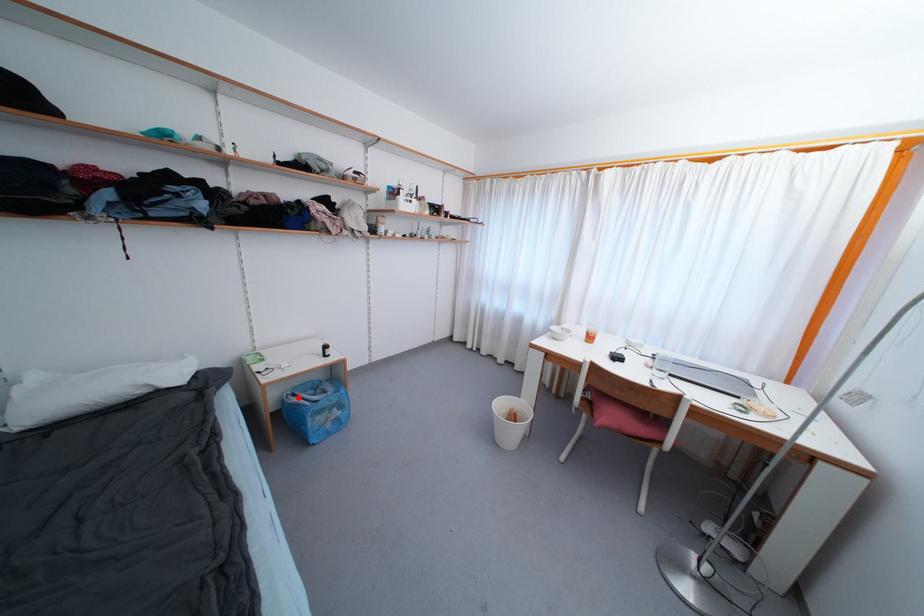
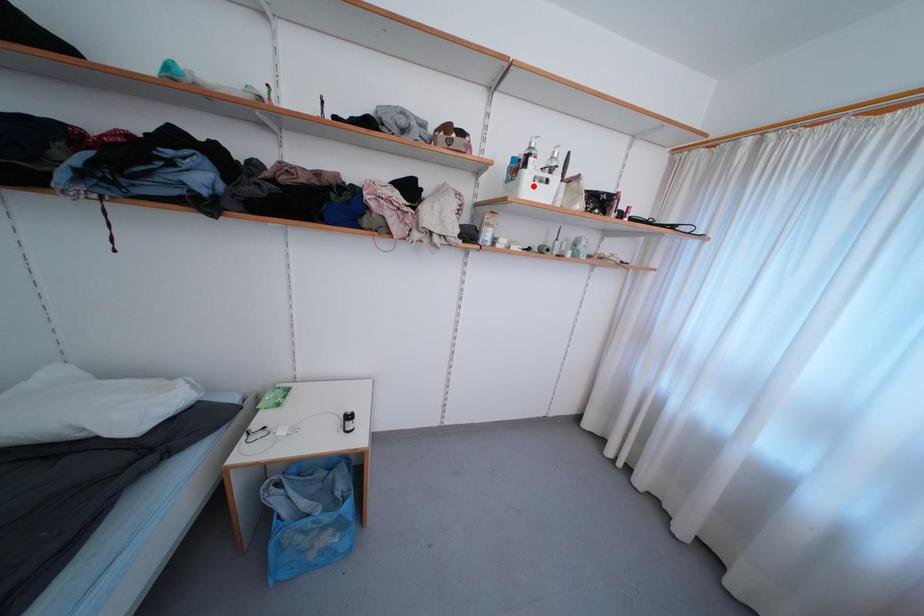
I am providing you with two images of the same scene from different viewpoints. A red point is marked on the first image and another point is marked on the second image. Is the marked point in image1 the same physical position as the marked point in image2?

No